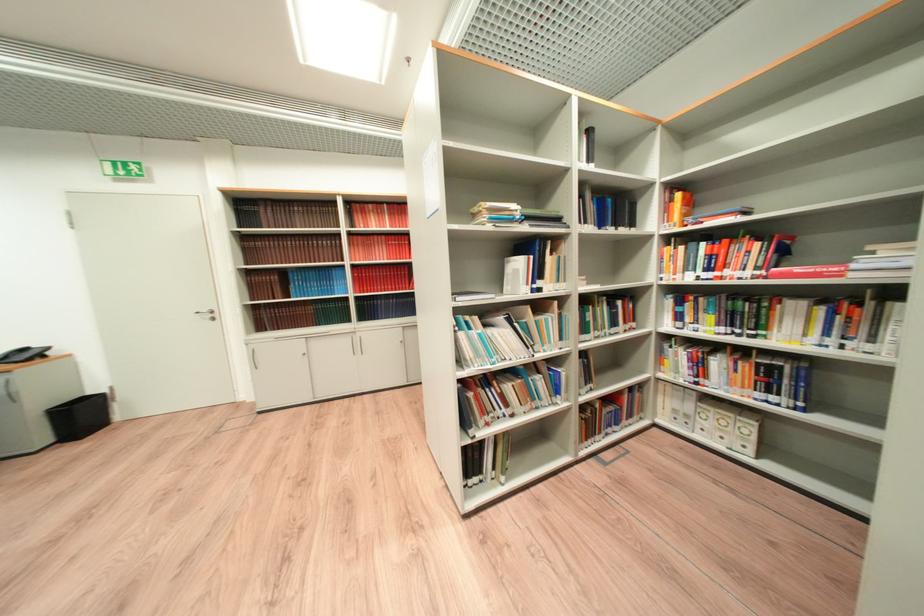
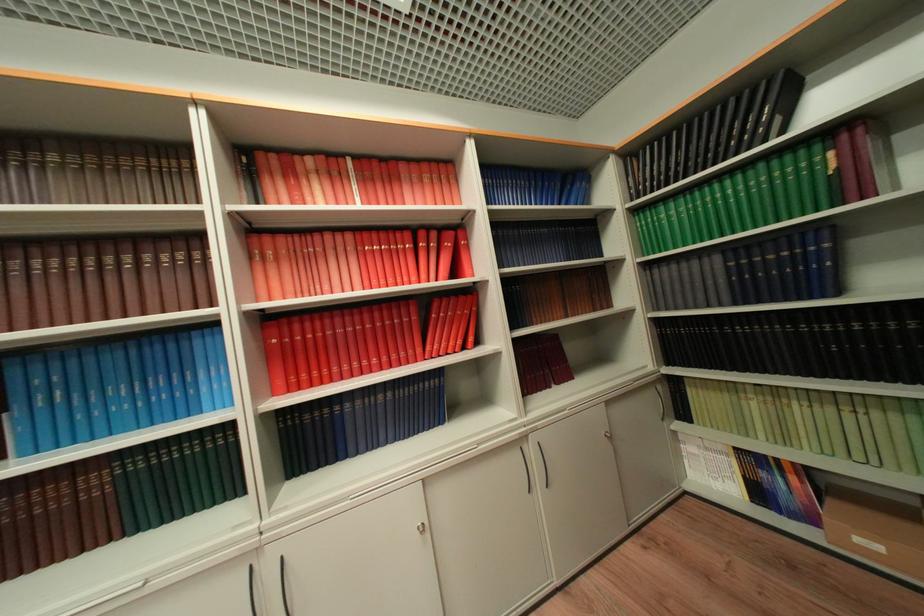
Locate, in the second image, the point that corresponds to (397,318) in the first image.

(383, 446)